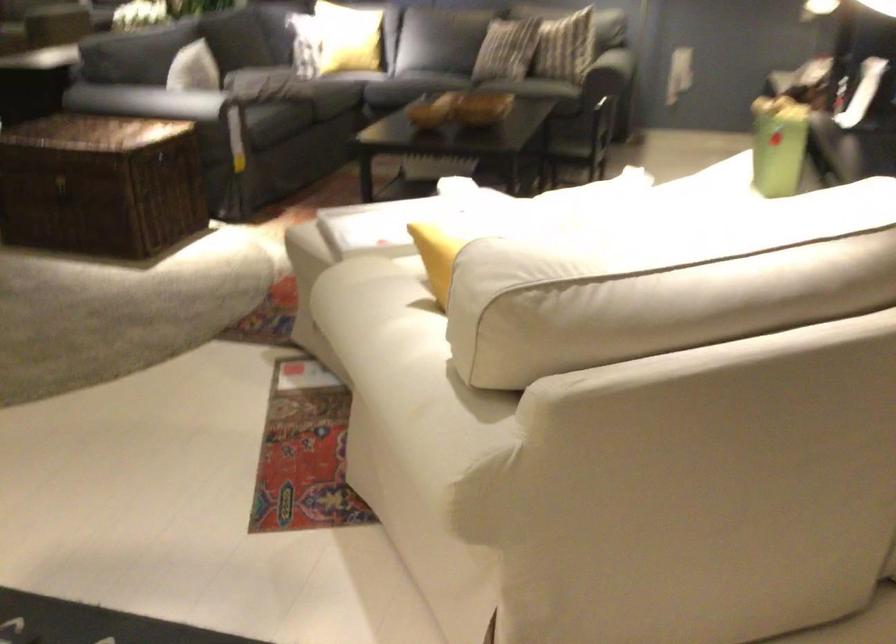
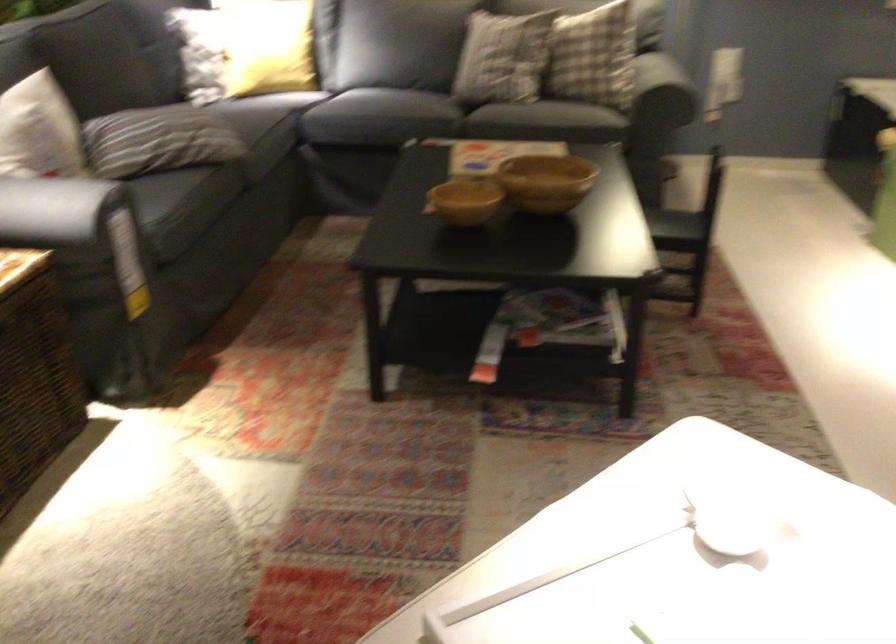
Question: What movement of the cameraman would produce the second image?

Choices:
 (A) Left
 (B) Right
 (C) Forward
 (D) Backward

Answer: (C)